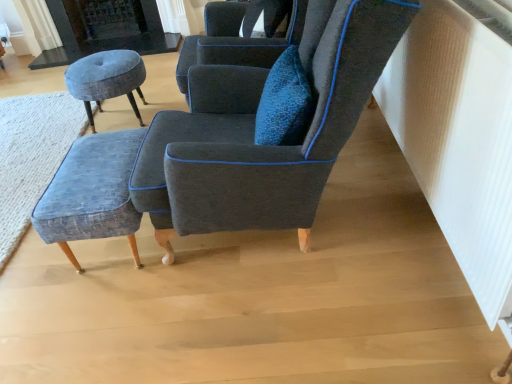
Image resolution: width=512 pixels, height=384 pixels. I want to click on velvet blue ottoman at lower left, so click(x=32, y=156).

In order to face velvet blue ottoman at lower left, should I rotate leftwards or rightwards?

Turn left by 31.315 degrees to look at velvet blue ottoman at lower left.

Where is `velvet blue armchair at center, which is the first chair from front to back`? velvet blue armchair at center, which is the first chair from front to back is located at coordinates (254, 131).

The image size is (512, 384). What are the coordinates of `velvet blue ottoman at lower left` in the screenshot? It's located at (32, 156).

Between velvet blue stool at left, the second stool viewed from the front, and textured blue fabric stool at lower left, acting as the 2th stool starting from the back, which one appears on the right side from the viewer's perspective?

From the viewer's perspective, textured blue fabric stool at lower left, acting as the 2th stool starting from the back, appears more on the right side.

Where is `stool located on the left of textured blue fabric stool at lower left, acting as the 2th stool starting from the back`? The width and height of the screenshot is (512, 384). stool located on the left of textured blue fabric stool at lower left, acting as the 2th stool starting from the back is located at coordinates (106, 79).

Is textured blue fabric stool at lower left, which ranks as the second stool in top-to-bottom order, a part of velvet blue stool at left, the 1th stool in the back-to-front sequence?

No, textured blue fabric stool at lower left, which ranks as the second stool in top-to-bottom order, is not a part of velvet blue stool at left, the 1th stool in the back-to-front sequence.

Is velvet blue stool at left, the second stool from the bottom, further to camera compared to textured blue fabric stool at lower left, which ranks as the second stool in top-to-bottom order?

Yes, it is.

Considering the relative sizes of textured blue fabric stool at lower left, the first stool in the front-to-back sequence, and velvet blue armchair at center, which is the first chair from front to back, in the image provided, is textured blue fabric stool at lower left, the first stool in the front-to-back sequence, smaller than velvet blue armchair at center, which is the first chair from front to back,?

Correct, textured blue fabric stool at lower left, the first stool in the front-to-back sequence, occupies less space than velvet blue armchair at center, which is the first chair from front to back.

In the image, is textured blue fabric stool at lower left, which ranks as the second stool in top-to-bottom order, on the left side or the right side of velvet blue armchair at center, placed as the second chair when sorted from back to front?

textured blue fabric stool at lower left, which ranks as the second stool in top-to-bottom order, is positioned on velvet blue armchair at center, placed as the second chair when sorted from back to front,'s left side.

From the image's perspective, which one is positioned higher, textured blue fabric stool at lower left, the first stool in the front-to-back sequence, or velvet blue armchair at center, placed as the second chair when sorted from back to front?

From the image's view, velvet blue armchair at center, placed as the second chair when sorted from back to front, is above.

Which object is wider, textured blue fabric stool at lower left, acting as the 2th stool starting from the back, or velvet blue armchair at center, placed as the second chair when sorted from back to front?

velvet blue armchair at center, placed as the second chair when sorted from back to front.

Is velvet blue ottoman at lower left beside velvet blue stool at left, placed as the first stool when sorted from top to bottom?

No, velvet blue ottoman at lower left is not with velvet blue stool at left, placed as the first stool when sorted from top to bottom.

Can you confirm if velvet blue ottoman at lower left is wider than velvet blue stool at left, the 1th stool in the back-to-front sequence?

Indeed, velvet blue ottoman at lower left has a greater width compared to velvet blue stool at left, the 1th stool in the back-to-front sequence.

This screenshot has width=512, height=384. What are the coordinates of `mat below the velvet blue stool at left, the 1th stool in the back-to-front sequence (from the image's perspective)` in the screenshot? It's located at (32, 156).

Considering the relative positions of velvet blue ottoman at lower left and velvet blue stool at left, the 1th stool in the back-to-front sequence, in the image provided, is velvet blue ottoman at lower left to the left of velvet blue stool at left, the 1th stool in the back-to-front sequence, from the viewer's perspective?

Yes, velvet blue ottoman at lower left is to the left of velvet blue stool at left, the 1th stool in the back-to-front sequence.

From a real-world perspective, which object stands above the other?

From a 3D spatial view, black stone fireplace at upper left is above.

Is velvet blue ottoman at lower left at the back of black stone fireplace at upper left?

No, black stone fireplace at upper left is not facing the opposite direction of velvet blue ottoman at lower left.

Is black stone fireplace at upper left far from velvet blue ottoman at lower left?

That's right, there is a large distance between black stone fireplace at upper left and velvet blue ottoman at lower left.

In the image, is black stone fireplace at upper left on the left side or the right side of velvet blue ottoman at lower left?

black stone fireplace at upper left is positioned on velvet blue ottoman at lower left's right side.

Considering the positions of point (75, 82) and point (313, 87), is point (75, 82) closer or farther from the camera than point (313, 87)?

Point (75, 82) appears to be farther away from the viewer than point (313, 87).

Can you confirm if velvet blue stool at left, placed as the first stool when sorted from top to bottom, is smaller than velvet blue armchair at center, placed as the second chair when sorted from back to front?

Yes, velvet blue stool at left, placed as the first stool when sorted from top to bottom, is smaller than velvet blue armchair at center, placed as the second chair when sorted from back to front.

Consider the image. In terms of width, does velvet blue stool at left, the second stool from the bottom, look wider or thinner when compared to velvet blue armchair at center, placed as the second chair when sorted from back to front?

In the image, velvet blue stool at left, the second stool from the bottom, appears to be more narrow than velvet blue armchair at center, placed as the second chair when sorted from back to front.

Could you measure the distance between velvet blue stool at left, the second stool from the bottom, and velvet blue armchair at center, which is the first chair from front to back?

velvet blue stool at left, the second stool from the bottom, and velvet blue armchair at center, which is the first chair from front to back, are 1.15 meters apart.

How different are the orientations of velvet blue stool at left, the 1th stool in the back-to-front sequence, and velvet dark blue armchair at center, placed as the 2th chair when sorted from front to back, in degrees?

The angle between the facing direction of velvet blue stool at left, the 1th stool in the back-to-front sequence, and the facing direction of velvet dark blue armchair at center, placed as the 2th chair when sorted from front to back, is 0.00218 degrees.

From a real-world perspective, is velvet blue stool at left, the second stool from the bottom, beneath velvet dark blue armchair at center, which is counted as the first chair, starting from the back?

Indeed, from a real-world perspective, velvet blue stool at left, the second stool from the bottom, is positioned beneath velvet dark blue armchair at center, which is counted as the first chair, starting from the back.

Can you confirm if velvet blue stool at left, the second stool viewed from the front, is taller than velvet dark blue armchair at center, placed as the 2th chair when sorted from front to back?

Incorrect, the height of velvet blue stool at left, the second stool viewed from the front, is not larger of that of velvet dark blue armchair at center, placed as the 2th chair when sorted from front to back.

In terms of size, does velvet blue stool at left, the second stool viewed from the front, appear bigger or smaller than velvet dark blue armchair at center, placed as the 2th chair when sorted from front to back?

Considering their sizes, velvet blue stool at left, the second stool viewed from the front, takes up less space than velvet dark blue armchair at center, placed as the 2th chair when sorted from front to back.

Could velvet blue ottoman at lower left be considered to be inside textured blue fabric stool at lower left, acting as the 2th stool starting from the back?

No, velvet blue ottoman at lower left is not inside textured blue fabric stool at lower left, acting as the 2th stool starting from the back.

Are textured blue fabric stool at lower left, the first stool in the front-to-back sequence, and velvet blue ottoman at lower left far apart?

No, there isn't a large distance between textured blue fabric stool at lower left, the first stool in the front-to-back sequence, and velvet blue ottoman at lower left.

Considering the sizes of objects textured blue fabric stool at lower left, acting as the 2th stool starting from the back, and velvet blue ottoman at lower left in the image provided, who is bigger, textured blue fabric stool at lower left, acting as the 2th stool starting from the back, or velvet blue ottoman at lower left?

velvet blue ottoman at lower left.

Is textured blue fabric stool at lower left, which ranks as the second stool in top-to-bottom order, taller than velvet blue ottoman at lower left?

Indeed, textured blue fabric stool at lower left, which ranks as the second stool in top-to-bottom order, has a greater height compared to velvet blue ottoman at lower left.

At what (x,y) coordinates should I click in order to perform the action: click on stool behind the textured blue fabric stool at lower left, which ranks as the second stool in top-to-bottom order. Please return your answer as a coordinate pair (x, y). This screenshot has height=384, width=512. Looking at the image, I should click on (106, 79).

From the velvet blue armchair at center, which is the first chair from front to back, count the 1st stool to the left and point to it. Please provide its 2D coordinates.

[(92, 193)]

From the image, which object appears to be nearer to velvet blue stool at left, the second stool viewed from the front, black stone fireplace at upper left or velvet dark blue armchair at center, placed as the 2th chair when sorted from front to back?

velvet dark blue armchair at center, placed as the 2th chair when sorted from front to back, is closer to velvet blue stool at left, the second stool viewed from the front.

Considering their positions, is velvet dark blue armchair at center, placed as the 2th chair when sorted from front to back, positioned further to velvet blue ottoman at lower left than velvet blue armchair at center, placed as the second chair when sorted from back to front?

velvet blue armchair at center, placed as the second chair when sorted from back to front, lies further to velvet blue ottoman at lower left than the other object.

Based on their spatial positions, is velvet blue ottoman at lower left or black stone fireplace at upper left closer to textured blue fabric stool at lower left, placed as the 1th stool when sorted from bottom to top?

velvet blue ottoman at lower left is positioned closer to the anchor textured blue fabric stool at lower left, placed as the 1th stool when sorted from bottom to top.

In the scene shown: From the image, which object appears to be farther from velvet blue armchair at center, placed as the second chair when sorted from back to front, black stone fireplace at upper left or velvet blue ottoman at lower left?

The object further to velvet blue armchair at center, placed as the second chair when sorted from back to front, is black stone fireplace at upper left.

Based on their spatial positions, is textured blue fabric stool at lower left, acting as the 2th stool starting from the back, or velvet blue ottoman at lower left further from black stone fireplace at upper left?

textured blue fabric stool at lower left, acting as the 2th stool starting from the back, is positioned further to the anchor black stone fireplace at upper left.

Estimate the real-world distances between objects in this image. Which object is closer to velvet dark blue armchair at center, placed as the 2th chair when sorted from front to back, velvet blue armchair at center, placed as the second chair when sorted from back to front, or textured blue fabric stool at lower left, placed as the 1th stool when sorted from bottom to top?

Among the two, velvet blue armchair at center, placed as the second chair when sorted from back to front, is located nearer to velvet dark blue armchair at center, placed as the 2th chair when sorted from front to back.

In the scene shown: Which object lies further to the anchor point velvet dark blue armchair at center, placed as the 2th chair when sorted from front to back, textured blue fabric stool at lower left, the first stool in the front-to-back sequence, or black stone fireplace at upper left?

Based on the image, black stone fireplace at upper left appears to be further to velvet dark blue armchair at center, placed as the 2th chair when sorted from front to back.

When comparing their distances from textured blue fabric stool at lower left, acting as the 2th stool starting from the back, does velvet blue ottoman at lower left or velvet dark blue armchair at center, placed as the 2th chair when sorted from front to back, seem closer?

velvet dark blue armchair at center, placed as the 2th chair when sorted from front to back, is positioned closer to the anchor textured blue fabric stool at lower left, acting as the 2th stool starting from the back.

This screenshot has width=512, height=384. In order to click on chair between velvet blue ottoman at lower left and black stone fireplace at upper left in the front-back direction in this screenshot , I will do `click(236, 40)`.

This screenshot has height=384, width=512. I want to click on mat located between velvet blue armchair at center, placed as the second chair when sorted from back to front, and black stone fireplace at upper left in the depth direction, so click(32, 156).

The width and height of the screenshot is (512, 384). What are the coordinates of `stool between velvet dark blue armchair at center, which is counted as the first chair, starting from the back, and textured blue fabric stool at lower left, the first stool in the front-to-back sequence, in the up-down direction` in the screenshot? It's located at (106, 79).

Find the location of a particular element. The height and width of the screenshot is (384, 512). chair between velvet dark blue armchair at center, placed as the 2th chair when sorted from front to back, and textured blue fabric stool at lower left, which ranks as the second stool in top-to-bottom order, in the vertical direction is located at coordinates (254, 131).